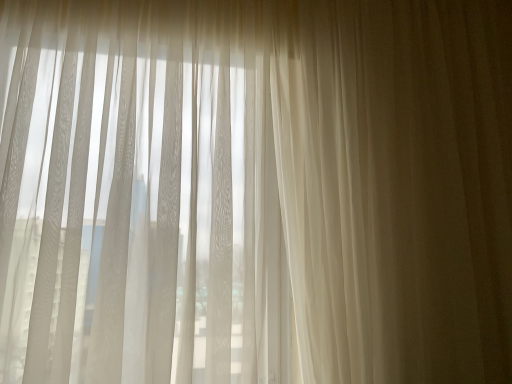
Locate an element on the screen. sheer white curtains at left is located at coordinates (140, 211).

What do you see at coordinates (140, 211) in the screenshot? I see `sheer white curtains at left` at bounding box center [140, 211].

The image size is (512, 384). What do you see at coordinates (397, 187) in the screenshot?
I see `sheer white curtain at right` at bounding box center [397, 187].

This screenshot has height=384, width=512. Identify the location of sheer white curtain at right. (397, 187).

I want to click on sheer white curtains at left, so click(x=140, y=211).

Which is more to the left, sheer white curtains at left or sheer white curtain at right?

sheer white curtains at left is more to the left.

Which is in front, sheer white curtains at left or sheer white curtain at right?

sheer white curtains at left.

Considering the positions of point (119, 82) and point (511, 332), is point (119, 82) closer or farther from the camera than point (511, 332)?

Clearly, point (119, 82) is closer to the camera than point (511, 332).

From the image's perspective, relative to sheer white curtain at right, is sheer white curtains at left above or below?

sheer white curtains at left is situated lower than sheer white curtain at right in the image.

From a real-world perspective, who is located lower, sheer white curtains at left or sheer white curtain at right?

sheer white curtains at left.

Which object is thinner, sheer white curtains at left or sheer white curtain at right?

Thinner between the two is sheer white curtain at right.

Is sheer white curtains at left taller or shorter than sheer white curtain at right?

In the image, sheer white curtains at left appears to be shorter than sheer white curtain at right.

In terms of size, does sheer white curtains at left appear bigger or smaller than sheer white curtain at right?

sheer white curtains at left is bigger than sheer white curtain at right.

In the scene shown: Is sheer white curtains at left located outside sheer white curtain at right?

That's correct, sheer white curtains at left is outside of sheer white curtain at right.

Is sheer white curtains at left far from sheer white curtain at right?

No, sheer white curtains at left is in close proximity to sheer white curtain at right.

Is sheer white curtains at left aimed at sheer white curtain at right?

No, sheer white curtains at left does not turn towards sheer white curtain at right.

How far apart are sheer white curtains at left and sheer white curtain at right?

sheer white curtains at left is 16.34 inches away from sheer white curtain at right.

Identify the location of bay window beneath the sheer white curtain at right (from a real-world perspective). (140, 211).

Is sheer white curtain at right at the right side of sheer white curtains at left?

Correct, you'll find sheer white curtain at right to the right of sheer white curtains at left.

Is the position of sheer white curtain at right less distant than that of sheer white curtains at left?

No, sheer white curtain at right is further to the viewer.

Does point (448, 172) appear closer or farther from the camera than point (181, 34)?

Point (448, 172) appears to be farther away from the viewer than point (181, 34).

From the image's perspective, is sheer white curtain at right located above sheer white curtains at left?

Correct, sheer white curtain at right appears higher than sheer white curtains at left in the image.

From a real-world perspective, between sheer white curtain at right and sheer white curtains at left, who is vertically higher?

sheer white curtain at right.

Is sheer white curtain at right wider or thinner than sheer white curtains at left?

In the image, sheer white curtain at right appears to be more narrow than sheer white curtains at left.

Consider the image. Considering the relative sizes of sheer white curtain at right and sheer white curtains at left in the image provided, is sheer white curtain at right shorter than sheer white curtains at left?

No.

Considering the relative sizes of sheer white curtain at right and sheer white curtains at left in the image provided, is sheer white curtain at right bigger than sheer white curtains at left?

No, sheer white curtain at right is not bigger than sheer white curtains at left.

Is sheer white curtain at right situated inside sheer white curtains at left or outside?

The correct answer is: outside.

Would you consider sheer white curtain at right to be distant from sheer white curtains at left?

No, sheer white curtain at right is in close proximity to sheer white curtains at left.

Is sheer white curtain at right positioned with its back to sheer white curtains at left?

No.

How different are the orientations of sheer white curtain at right and sheer white curtains at left in degrees?

0.000314 degrees separate the facing orientations of sheer white curtain at right and sheer white curtains at left.

How distant is sheer white curtain at right from sheer white curtains at left?

sheer white curtain at right is 16.34 inches away from sheer white curtains at left.

Identify the location of curtain above the sheer white curtains at left (from the image's perspective). The image size is (512, 384). (397, 187).

Find the location of a particular element. curtain above the sheer white curtains at left (from a real-world perspective) is located at coordinates (397, 187).

This screenshot has height=384, width=512. In order to click on bay window lying below the sheer white curtain at right (from the image's perspective) in this screenshot , I will do (140, 211).